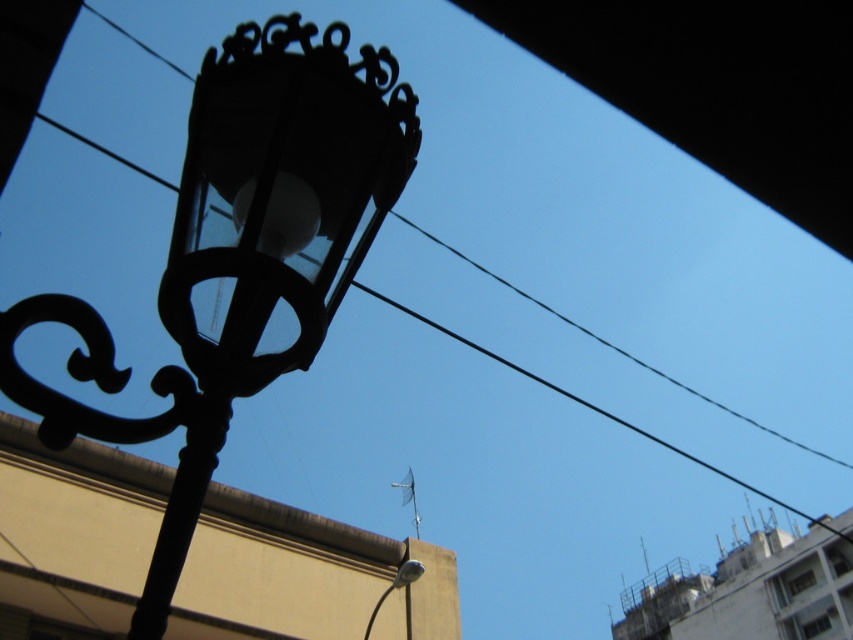
Question: Is black wrought iron lamp post at upper left to the right of metallic silver streetlight at lower center from the viewer's perspective?

Choices:
 (A) yes
 (B) no

Answer: (A)

Question: Which of the following is the closest to the observer?

Choices:
 (A) metallic silver streetlight at lower center
 (B) black wrought iron lamp post at upper left

Answer: (B)

Question: Does black wrought iron lamp post at upper left have a larger size compared to metallic silver streetlight at lower center?

Choices:
 (A) yes
 (B) no

Answer: (B)

Question: Observing the image, what is the correct spatial positioning of black wrought iron lamp post at upper left in reference to metallic silver streetlight at lower center?

Choices:
 (A) below
 (B) above

Answer: (B)

Question: Among these points, which one is farthest from the camera?

Choices:
 (A) (223, 364)
 (B) (396, 579)

Answer: (B)